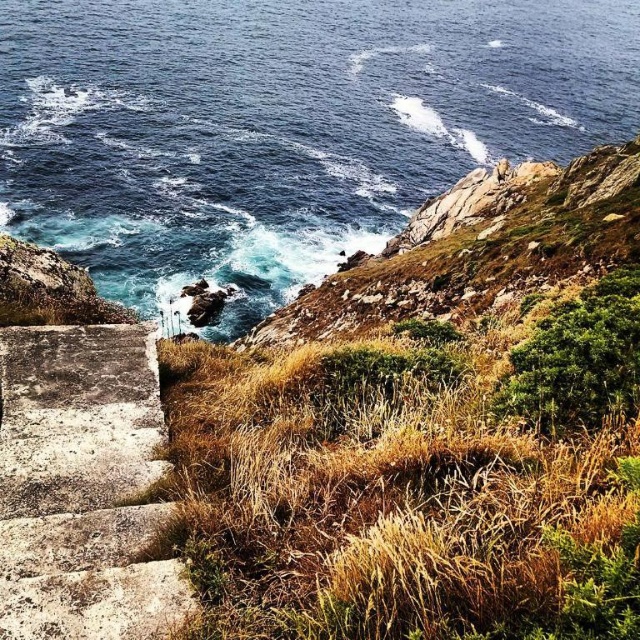
Question: Does blue water at upper left have a smaller size compared to concrete stairs at lower left?

Choices:
 (A) no
 (B) yes

Answer: (A)

Question: Can you confirm if blue water at upper left is positioned to the left of concrete stairs at lower left?

Choices:
 (A) yes
 (B) no

Answer: (B)

Question: Which point is farther from the camera taking this photo?

Choices:
 (A) click(x=474, y=166)
 (B) click(x=68, y=499)

Answer: (A)

Question: Can you confirm if blue water at upper left is smaller than concrete stairs at lower left?

Choices:
 (A) no
 (B) yes

Answer: (A)